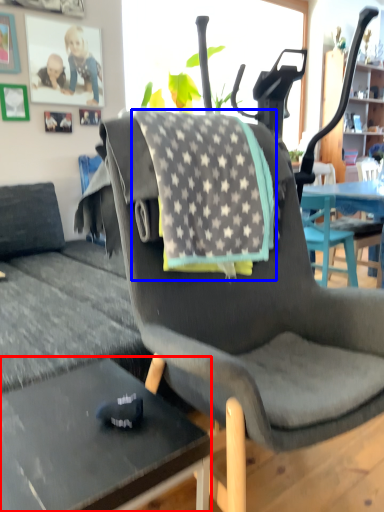
Question: Among these objects, which one is farthest to the camera, desk (highlighted by a red box) or blanket (highlighted by a blue box)?

Choices:
 (A) desk
 (B) blanket

Answer: (B)